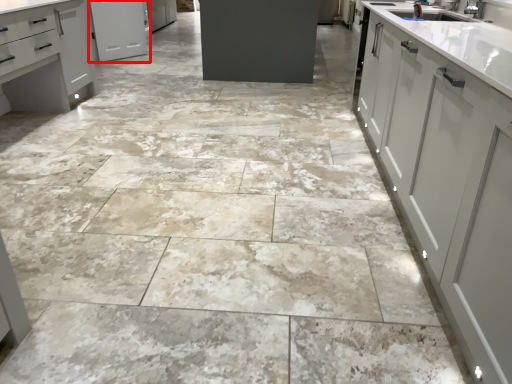
Question: From the image's perspective, considering the relative positions of cabinetry (annotated by the red box) and cabinetry in the image provided, where is cabinetry (annotated by the red box) located with respect to the staircase?

Choices:
 (A) below
 (B) above

Answer: (B)